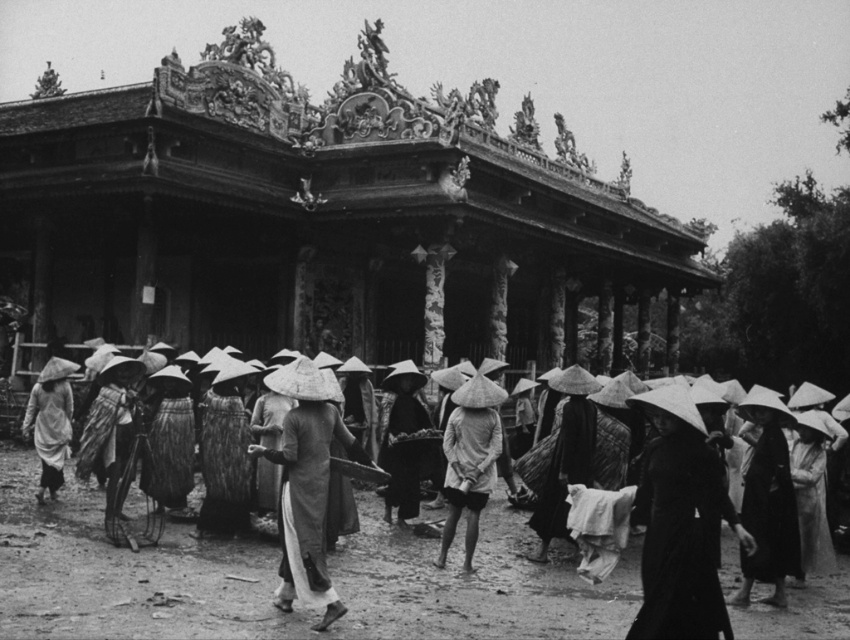
Question: Does white cotton ao dai at center appear over matte white conical hat at center?

Choices:
 (A) yes
 (B) no

Answer: (A)

Question: Is matte straw hat at center wider than black matte conical hat at center?

Choices:
 (A) yes
 (B) no

Answer: (A)

Question: Is black matte conical hat at center in front of matte white conical hat at center?

Choices:
 (A) yes
 (B) no

Answer: (A)

Question: Among these objects, which one is farthest from the camera?

Choices:
 (A) wooden carved palace at center
 (B) white cotton ao dai at center
 (C) matte straw hat at center

Answer: (A)

Question: Which point is closer to the camera?

Choices:
 (A) (286, 472)
 (B) (499, 445)
 (C) (639, 497)
 (D) (54, 496)

Answer: (A)

Question: Among these objects, which one is farthest from the camera?

Choices:
 (A) matte white conical hat at center
 (B) white cotton ao dai at center

Answer: (A)